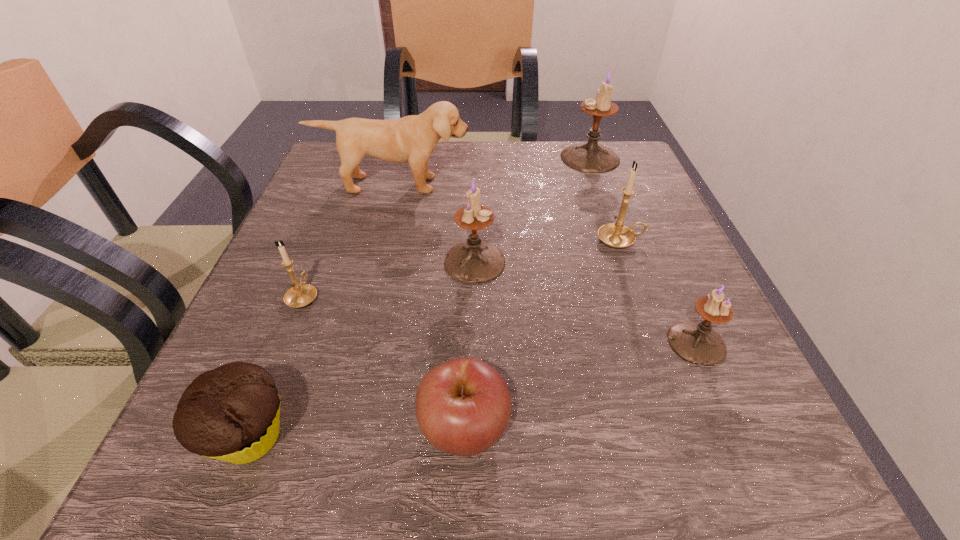
Where is `muffin present at the left edge`? This screenshot has height=540, width=960. muffin present at the left edge is located at coordinates pyautogui.click(x=232, y=413).

Identify the location of object located at the far left corner. (413, 138).

Where is `object present at the near left corner`? object present at the near left corner is located at coordinates (232, 413).

Locate an element on the screen. object positioned at the far right corner is located at coordinates (590, 157).

Where is `vacant space at the far edge of the desktop`? This screenshot has height=540, width=960. vacant space at the far edge of the desktop is located at coordinates (507, 144).

Where is `vacant space at the near edge`? The width and height of the screenshot is (960, 540). vacant space at the near edge is located at coordinates (341, 490).

This screenshot has height=540, width=960. In order to click on vacant space at the left edge of the desktop in this screenshot , I will do `click(286, 349)`.

The image size is (960, 540). In the image, there is a desktop. Find the location of `free region at the right edge`. free region at the right edge is located at coordinates [590, 220].

The width and height of the screenshot is (960, 540). In order to click on free spot at the far left corner of the desktop in this screenshot , I will do `click(372, 168)`.

Where is `free point at the far right corner`? The image size is (960, 540). free point at the far right corner is located at coordinates 612,193.